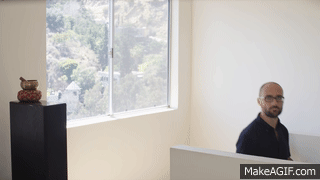
Where is `window`? The height and width of the screenshot is (180, 320). window is located at coordinates (84, 39), (133, 15).